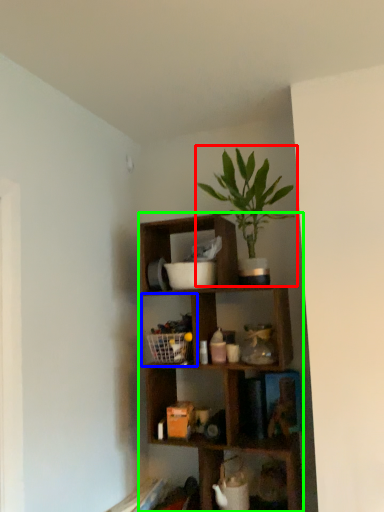
Question: Considering the real-world distances, which object is closest to houseplant (highlighted by a red box)? cabinet (highlighted by a blue box) or shelf (highlighted by a green box).

Choices:
 (A) cabinet
 (B) shelf

Answer: (B)